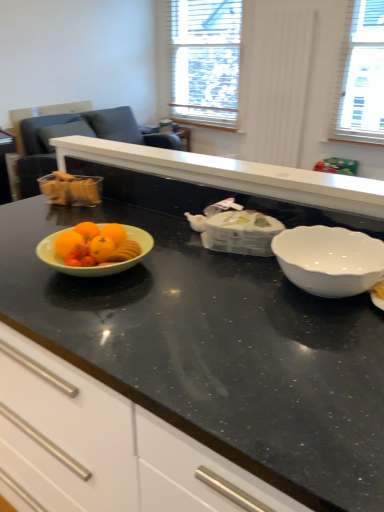
Question: Is white wood blinds at upper center inside the boundaries of matte gray armchair at left, or outside?

Choices:
 (A) outside
 (B) inside

Answer: (A)

Question: From the image's perspective, is white wood blinds at upper center above or below matte gray armchair at left?

Choices:
 (A) above
 (B) below

Answer: (A)

Question: Estimate the real-world distances between objects in this image. Which object is farther from the white wood blinds at upper center?

Choices:
 (A) white glossy bowl at right
 (B) translucent plastic container at left
 (C) matte gray armchair at left
 (D) black granite countertop at center

Answer: (D)

Question: Based on their relative distances, which object is nearer to the white wood blinds at upper center?

Choices:
 (A) translucent plastic container at left
 (B) white glossy bowl at right
 (C) matte gray armchair at left
 (D) black granite countertop at center

Answer: (C)